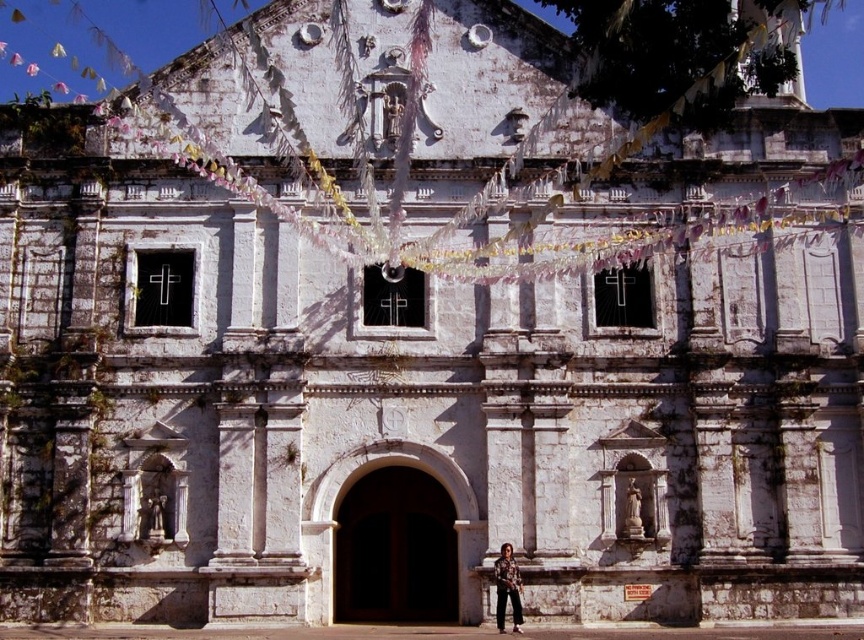
Between brown wooden door at center and camouflage shirt at lower center, which one appears on the left side from the viewer's perspective?

Positioned to the left is brown wooden door at center.

Is brown wooden door at center closer to camera compared to camouflage shirt at lower center?

No, it is not.

Does point (424, 552) come farther from viewer compared to point (496, 612)?

Yes, point (424, 552) is farther from viewer.

You are a GUI agent. You are given a task and a screenshot of the screen. Output one action in this format:
    pyautogui.click(x=<x>, y=<y>)
    Task: Click on the brown wooden door at center
    
    Given the screenshot: What is the action you would take?
    pyautogui.click(x=395, y=548)